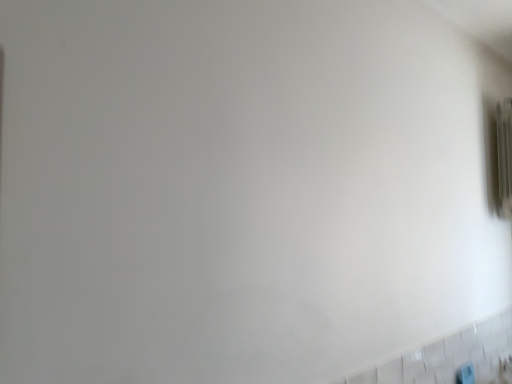
You are a GUI agent. You are given a task and a screenshot of the screen. Output one action in this format:
    pyautogui.click(x=<x>, y=<y>)
    Task: Click on the metallic silver window at upper right
    The width and height of the screenshot is (512, 384).
    Given the screenshot: What is the action you would take?
    pyautogui.click(x=499, y=158)

This screenshot has width=512, height=384. What do you see at coordinates (499, 158) in the screenshot?
I see `metallic silver window at upper right` at bounding box center [499, 158].

Locate an element on the screen. Image resolution: width=512 pixels, height=384 pixels. metallic silver window at upper right is located at coordinates (499, 158).